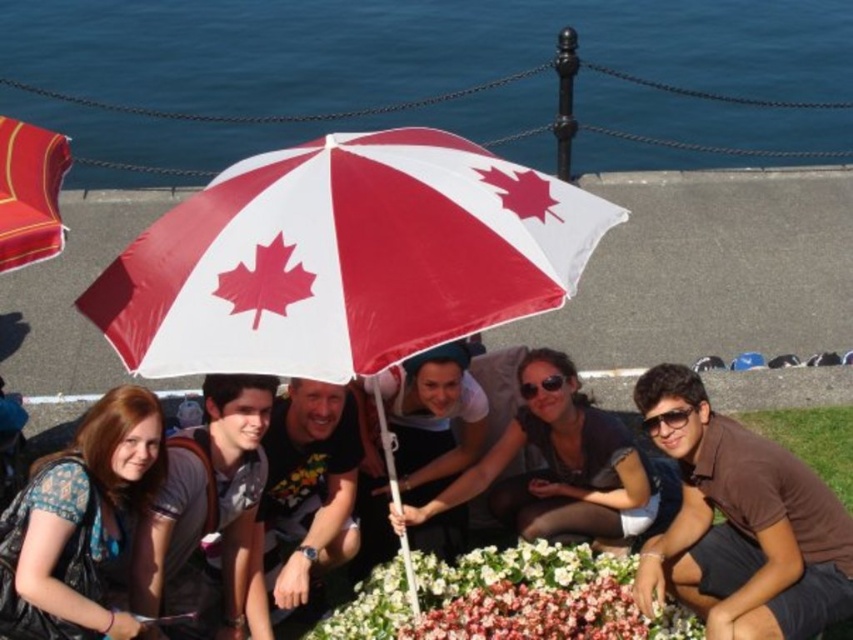
Question: Which point appears farthest from the camera in this image?

Choices:
 (A) (351, 636)
 (B) (47, 637)

Answer: (A)

Question: In this image, where is matte black backpack at lower left located relative to matte black t-shirt at center?

Choices:
 (A) left
 (B) right

Answer: (A)

Question: Which object appears farthest from the camera in this image?

Choices:
 (A) green grass at lower right
 (B) patterned fabric shirt at lower left

Answer: (A)

Question: Does brown cotton shirt at lower right appear on the right side of floral fabric flower bed at center?

Choices:
 (A) yes
 (B) no

Answer: (A)

Question: Among these objects, which one is nearest to the camera?

Choices:
 (A) matte black backpack at lower left
 (B) red and white fabric umbrella at center
 (C) brown cotton shirt at lower right
 (D) floral fabric flower bed at center

Answer: (B)

Question: Does brown cotton shirt at lower right have a smaller size compared to matte black backpack at lower left?

Choices:
 (A) yes
 (B) no

Answer: (B)